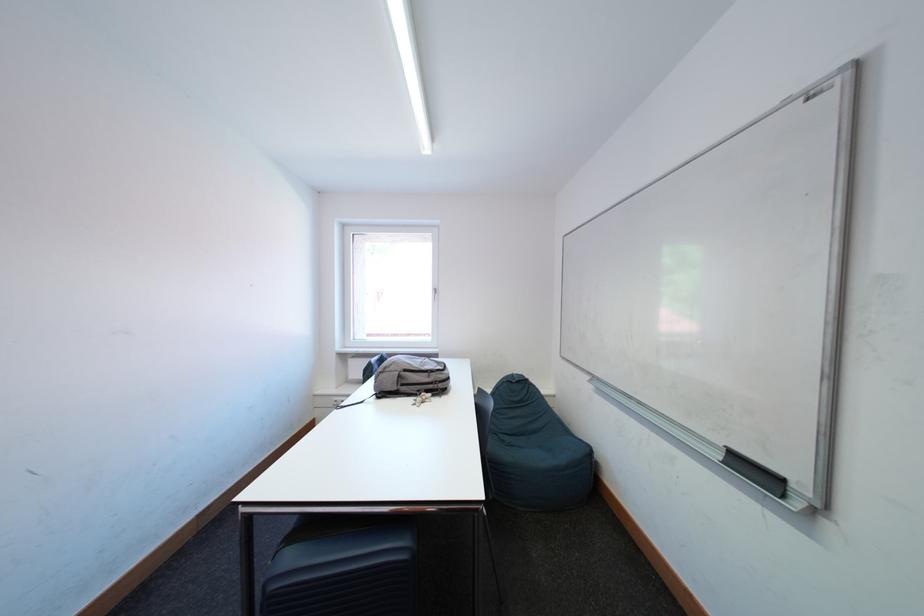
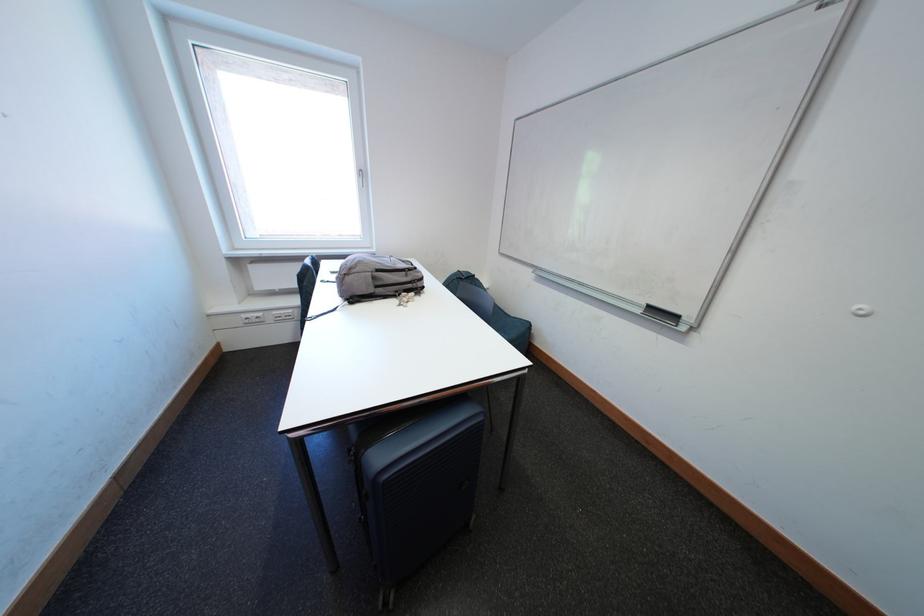
Locate, in the second image, the point that corresponds to point (428, 394) in the first image.

(406, 294)